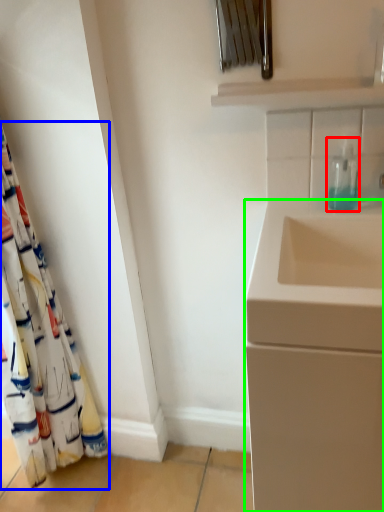
Question: Which object is positioned farthest from soap dispenser (highlighted by a red box)? Select from curtain (highlighted by a blue box) and bathroom cabinet (highlighted by a green box).

Choices:
 (A) curtain
 (B) bathroom cabinet

Answer: (A)